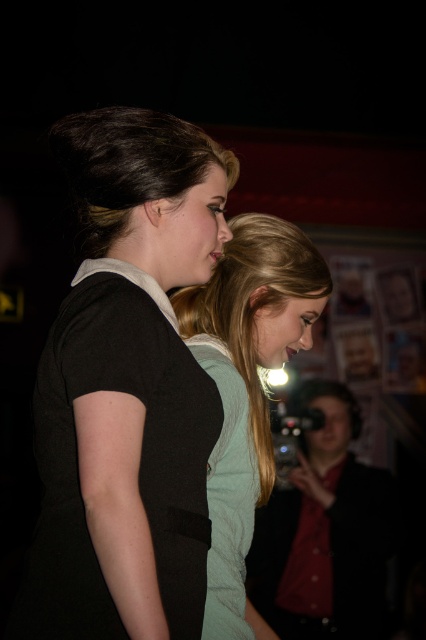
You are standing in the scene and want to take a photo of the two women in the foreground without being seen by them. The camera you need is located at a specific coordinate. Which object at point (325,531) can you use?

The point (325,531) corresponds to the matte black camera at lower right, so you can use the matte black camera at lower right to take the photo without being seen.